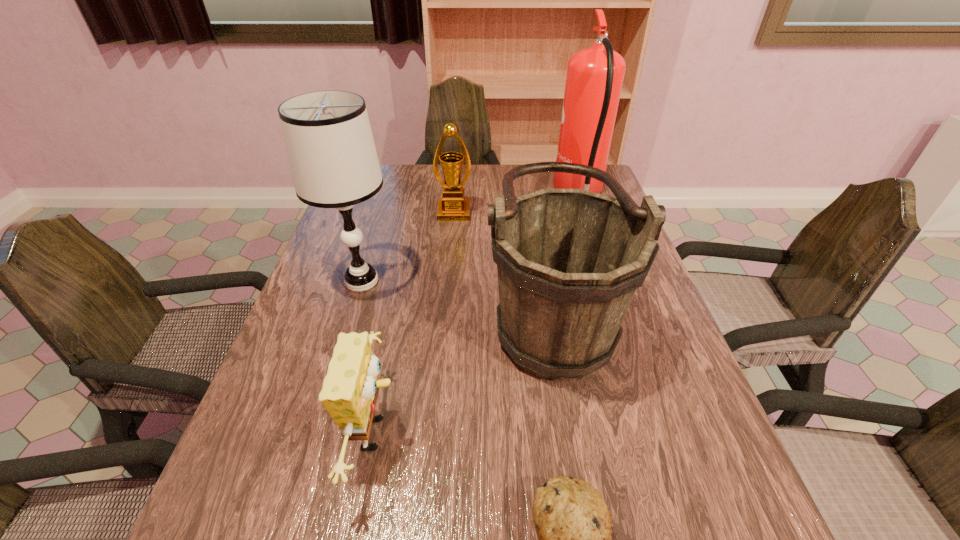
In order to click on fire extinguisher in this screenshot , I will do `click(594, 79)`.

Where is `table lamp`? The height and width of the screenshot is (540, 960). table lamp is located at coordinates (332, 155).

I want to click on bucket, so click(x=569, y=261).

I want to click on the fourth tallest object, so [453, 206].

Where is `award`? award is located at coordinates (453, 206).

Where is `sponge`? sponge is located at coordinates [350, 389].

The width and height of the screenshot is (960, 540). Find the location of `vacant space positioned towards the nozzle of the fire extinguisher`. vacant space positioned towards the nozzle of the fire extinguisher is located at coordinates (491, 193).

Find the location of a particular element. blank area located 0.300m towards the nozzle of the fire extinguisher is located at coordinates (463, 193).

Image resolution: width=960 pixels, height=540 pixels. I want to click on free spot located towards the nozzle of the fire extinguisher, so click(512, 193).

Locate an element on the screen. Image resolution: width=960 pixels, height=540 pixels. vacant space positioned 0.310m on the right of the table lamp is located at coordinates (520, 281).